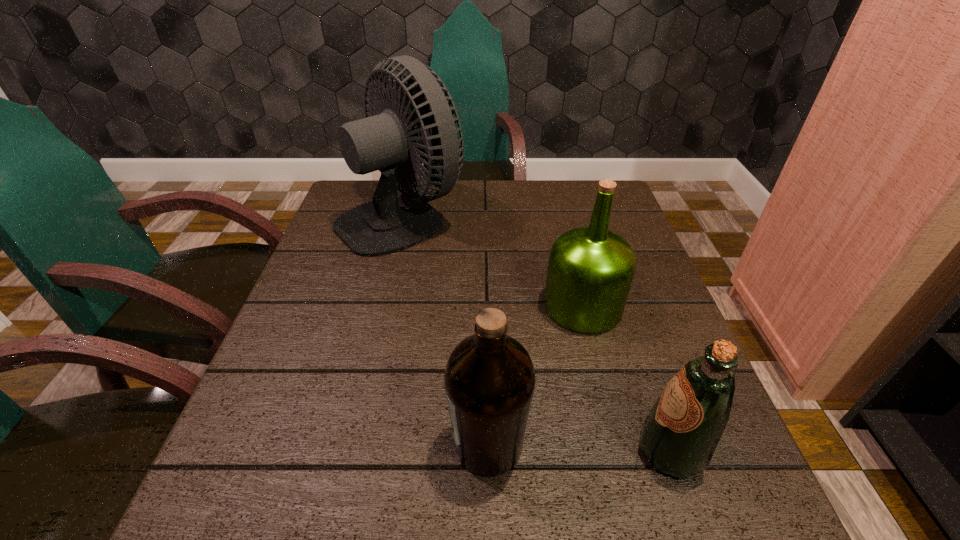
Identify the location of vacant space located 0.290m on the front-facing side of the shortest olive oil. The width and height of the screenshot is (960, 540). (457, 451).

You are a GUI agent. You are given a task and a screenshot of the screen. Output one action in this format:
    pyautogui.click(x=<x>, y=<y>)
    Task: Click on the blank area located on the front-facing side of the shortest olive oil
    
    Given the screenshot: What is the action you would take?
    494,451

I want to click on vacant area situated 0.250m on the front-facing side of the shortest olive oil, so click(482, 451).

Locate an element on the screen. The width and height of the screenshot is (960, 540). object that is positioned at the far edge is located at coordinates (389, 223).

Where is `object at the left edge`? The width and height of the screenshot is (960, 540). object at the left edge is located at coordinates (389, 223).

What are the coordinates of `object that is at the far left corner` in the screenshot? It's located at (389, 223).

The image size is (960, 540). Identify the location of object positioned at the near right corner. (679, 436).

The height and width of the screenshot is (540, 960). In order to click on vacant space at the far edge in this screenshot , I will do `click(473, 204)`.

Find the location of a particular element. The image size is (960, 540). vacant space at the near edge of the desktop is located at coordinates (378, 515).

Image resolution: width=960 pixels, height=540 pixels. Identify the location of vacant space at the left edge. (358, 276).